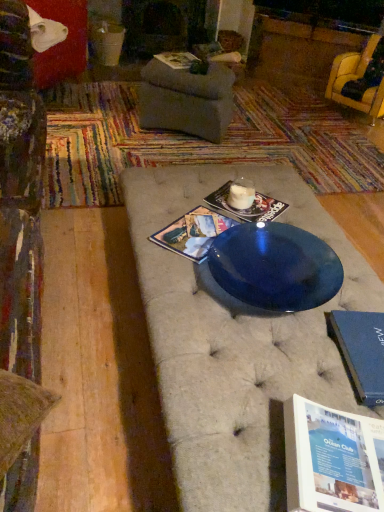
Identify the location of white glossy plate at center. pos(244,209).

Image resolution: width=384 pixels, height=512 pixels. What do you see at coordinates (198, 143) in the screenshot? I see `matte gray ottoman at center` at bounding box center [198, 143].

What do you see at coordinates (249, 207) in the screenshot? I see `matte paper magazine at center, arranged as the 2th magazine when viewed from the front` at bounding box center [249, 207].

Where is `matte paper magazine at center, arranged as the 2th magazine when viewed from the front`? The image size is (384, 512). matte paper magazine at center, arranged as the 2th magazine when viewed from the front is located at coordinates (249, 207).

Image resolution: width=384 pixels, height=512 pixels. Identify the location of yellow fabric chair at upper right. (356, 80).

Describe the element at coordinates (177, 59) in the screenshot. I see `matte paper magazine at upper center, which is the first magazine from top to bottom` at that location.

The height and width of the screenshot is (512, 384). I want to click on white glossy plate at center, so click(244, 209).

Which object is further away from the camera taking this photo, white glossy book at lower right or white glossy plate at center?

white glossy plate at center is further away from the camera.

Which object is thinner, white glossy book at lower right or white glossy plate at center?

white glossy plate at center is thinner.

Which of these two, white glossy book at lower right or white glossy plate at center, is bigger?

white glossy book at lower right is bigger.

Considering the sizes of matte paper magazine at center, acting as the first magazine starting from the bottom, and matte paper magazine at center, arranged as the 2th magazine when viewed from the front, in the image, is matte paper magazine at center, acting as the first magazine starting from the bottom, wider or thinner than matte paper magazine at center, arranged as the 2th magazine when viewed from the front,?

matte paper magazine at center, acting as the first magazine starting from the bottom, is wider than matte paper magazine at center, arranged as the 2th magazine when viewed from the front.

Is the depth of matte paper magazine at center, the third magazine when ordered from top to bottom, less than that of matte paper magazine at center, the second magazine positioned from the top?

Yes, it is in front of matte paper magazine at center, the second magazine positioned from the top.

Considering the sizes of matte paper magazine at center, arranged as the third magazine when viewed from the back, and matte paper magazine at center, the second magazine positioned from the top, in the image, is matte paper magazine at center, arranged as the third magazine when viewed from the back, taller or shorter than matte paper magazine at center, the second magazine positioned from the top,?

Clearly, matte paper magazine at center, arranged as the third magazine when viewed from the back, is taller compared to matte paper magazine at center, the second magazine positioned from the top.

Can you confirm if matte paper magazine at center, arranged as the third magazine when viewed from the back, is bigger than matte paper magazine at center, the second magazine viewed from the back?

Correct, matte paper magazine at center, arranged as the third magazine when viewed from the back, is larger in size than matte paper magazine at center, the second magazine viewed from the back.

Measure the distance from matte gray ottoman at center to matte paper magazine at upper center, which is the first magazine from top to bottom.

The distance of matte gray ottoman at center from matte paper magazine at upper center, which is the first magazine from top to bottom, is 73.06 centimeters.

Based on their sizes in the image, would you say matte gray ottoman at center is bigger or smaller than matte paper magazine at upper center, which is the first magazine from back to front?

Considering their sizes, matte gray ottoman at center takes up more space than matte paper magazine at upper center, which is the first magazine from back to front.

Is matte gray ottoman at center taller than matte paper magazine at upper center, the third magazine in the front-to-back sequence?

Indeed, matte gray ottoman at center has a greater height compared to matte paper magazine at upper center, the third magazine in the front-to-back sequence.

From the image's perspective, is matte gray ottoman at center above matte paper magazine at upper center, which is the 3th magazine in bottom-to-top order?

No, from the image's perspective, matte gray ottoman at center is not on top of matte paper magazine at upper center, which is the 3th magazine in bottom-to-top order.

Consider the image. Which object is further away from the camera, shiny blue glass plate at center or matte paper magazine at center, which appears as the 1th magazine when viewed from the front?

matte paper magazine at center, which appears as the 1th magazine when viewed from the front, is more distant.

Is shiny blue glass plate at center facing away from matte paper magazine at center, the third magazine when ordered from top to bottom?

shiny blue glass plate at center is not turned away from matte paper magazine at center, the third magazine when ordered from top to bottom.

Would you consider shiny blue glass plate at center to be distant from matte paper magazine at center, which appears as the 1th magazine when viewed from the front?

No, shiny blue glass plate at center is not far from matte paper magazine at center, which appears as the 1th magazine when viewed from the front.

Which object is wider, shiny blue glass plate at center or matte paper magazine at center, the third magazine when ordered from top to bottom?

With larger width is shiny blue glass plate at center.

From a real-world perspective, is white glossy plate at center over matte gray ottoman at center?

Yes, from a real-world perspective, white glossy plate at center is over matte gray ottoman at center

Are white glossy plate at center and matte gray ottoman at center far apart?

white glossy plate at center is positioned a significant distance from matte gray ottoman at center.

Considering the relative sizes of white glossy plate at center and matte gray ottoman at center in the image provided, is white glossy plate at center smaller than matte gray ottoman at center?

Indeed, white glossy plate at center has a smaller size compared to matte gray ottoman at center.

Which is farther, (206, 240) or (323, 474)?

The point (206, 240) is more distant.

Is matte paper magazine at center, which appears as the 1th magazine when viewed from the front, not near white glossy book at lower right?

No.

How different are the orientations of matte paper magazine at center, arranged as the third magazine when viewed from the back, and white glossy book at lower right in degrees?

The angle between the facing direction of matte paper magazine at center, arranged as the third magazine when viewed from the back, and the facing direction of white glossy book at lower right is 59.1 degrees.

From the picture: Is matte paper magazine at center, the third magazine when ordered from top to bottom, surrounding white glossy book at lower right?

Definitely not — white glossy book at lower right is not inside matte paper magazine at center, the third magazine when ordered from top to bottom.

Can you confirm if gray fabric footrest at center is taller than white glossy book at lower right?

Yes, gray fabric footrest at center is taller than white glossy book at lower right.

From a real-world perspective, which is physically above, gray fabric footrest at center or white glossy book at lower right?

white glossy book at lower right is physically above.

Is point (175, 94) more distant than point (315, 430)?

Yes, point (175, 94) is farther from viewer.

Identify the location of book above the gray fabric footrest at center (from a real-world perspective). This screenshot has width=384, height=512. (330, 459).

The width and height of the screenshot is (384, 512). Identify the location of plate above the white glossy book at lower right (from the image's perspective). (244, 209).

The width and height of the screenshot is (384, 512). Find the location of `magazine that appears below the matte paper magazine at center, the third magazine when ordered from top to bottom (from a real-world perspective)`. magazine that appears below the matte paper magazine at center, the third magazine when ordered from top to bottom (from a real-world perspective) is located at coordinates pyautogui.click(x=249, y=207).

Looking at the image, which one is located further to white glossy plate at center, matte paper magazine at center, arranged as the third magazine when viewed from the back, or matte paper magazine at center, arranged as the 2th magazine when viewed from the front?

matte paper magazine at center, arranged as the third magazine when viewed from the back, is further to white glossy plate at center.

Based on their spatial positions, is blue hardcover book at lower right or shiny blue glass plate at center closer to matte paper magazine at upper center, which is the first magazine from top to bottom?

Among the two, shiny blue glass plate at center is located nearer to matte paper magazine at upper center, which is the first magazine from top to bottom.

Based on the photo, estimate the real-world distances between objects in this image. Which object is further from yellow fabric chair at upper right, blue hardcover book at lower right or white glossy book at lower right?

white glossy book at lower right.

Considering their positions, is yellow fabric chair at upper right positioned closer to gray fabric footrest at center than white glossy plate at center?

white glossy plate at center.

Estimate the real-world distances between objects in this image. Which object is closer to matte paper magazine at center, arranged as the 2th magazine when viewed from the front, white glossy plate at center or shiny blue glass plate at center?

white glossy plate at center is closer to matte paper magazine at center, arranged as the 2th magazine when viewed from the front.

Based on their spatial positions, is matte paper magazine at center, acting as the first magazine starting from the bottom, or gray fabric footrest at center further from matte paper magazine at upper center, which is the first magazine from top to bottom?

The object further to matte paper magazine at upper center, which is the first magazine from top to bottom, is matte paper magazine at center, acting as the first magazine starting from the bottom.

When comparing their distances from shiny blue glass plate at center, does gray fabric footrest at center or matte paper magazine at center, which appears as the 1th magazine when viewed from the front, seem closer?

matte paper magazine at center, which appears as the 1th magazine when viewed from the front, lies closer to shiny blue glass plate at center than the other object.

Based on their spatial positions, is blue hardcover book at lower right or matte paper magazine at center, arranged as the third magazine when viewed from the back, closer to matte gray ottoman at center?

matte paper magazine at center, arranged as the third magazine when viewed from the back, is closer to matte gray ottoman at center.

You are a GUI agent. You are given a task and a screenshot of the screen. Output one action in this format:
    pyautogui.click(x=<x>, y=<y>)
    Task: Click on the footrest positioned between white glossy plate at center and matte paper magazine at upper center, which is the first magazine from back to front, from near to far
    The image size is (384, 512).
    Given the screenshot: What is the action you would take?
    click(186, 100)

Find the location of `paperback book between shiny blue glass plate at center and matte paper magazine at upper center, which is the first magazine from top to bottom, from front to back`. paperback book between shiny blue glass plate at center and matte paper magazine at upper center, which is the first magazine from top to bottom, from front to back is located at coordinates (362, 351).

You are a GUI agent. You are given a task and a screenshot of the screen. Output one action in this format:
    pyautogui.click(x=<x>, y=<y>)
    Task: Click on the footrest between blue hardcover book at lower right and yellow fabric chair at upper right from front to back
    
    Given the screenshot: What is the action you would take?
    pyautogui.click(x=186, y=100)

Where is `footrest between white glossy book at lower right and matte paper magazine at upper center, the third magazine in the front-to-back sequence, in the front-back direction`? The height and width of the screenshot is (512, 384). footrest between white glossy book at lower right and matte paper magazine at upper center, the third magazine in the front-to-back sequence, in the front-back direction is located at coordinates coord(186,100).